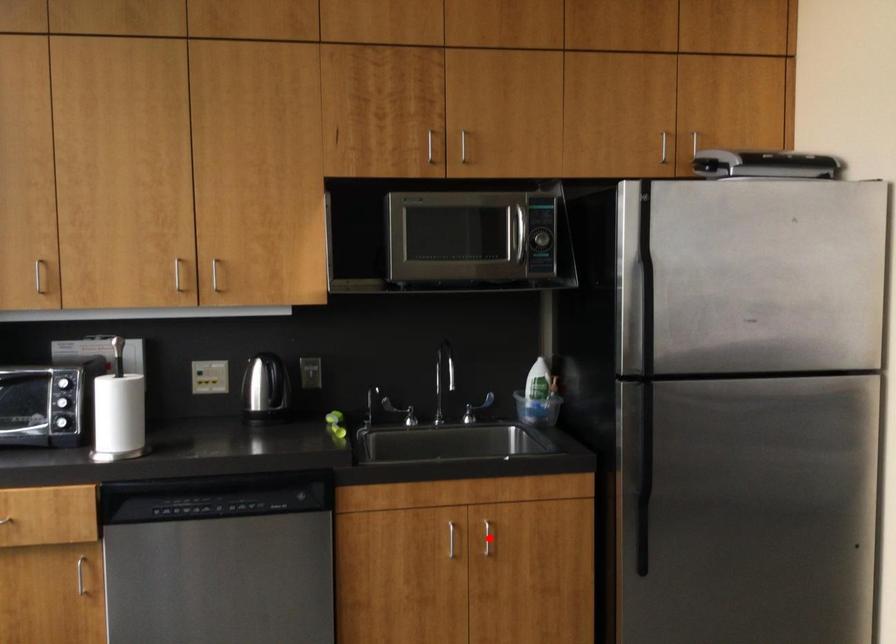
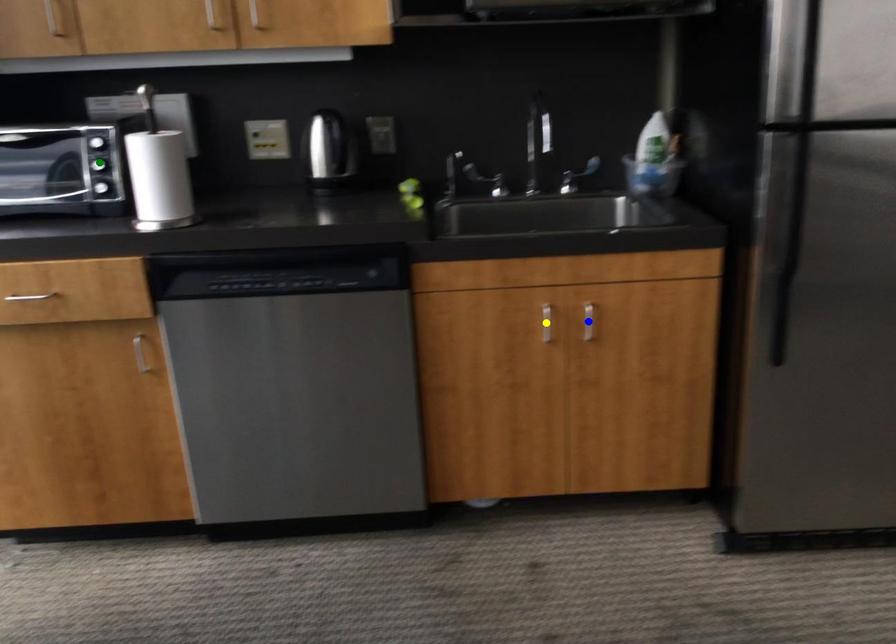
Question: I am providing you with two images of the same scene from different viewpoints. A red point is marked on the first image. You are given multiple points on the second image. Which point in image 2 is actually the same real-world point as the red point in image 1?

Choices:
 (A) yellow point
 (B) blue point
 (C) green point

Answer: (B)